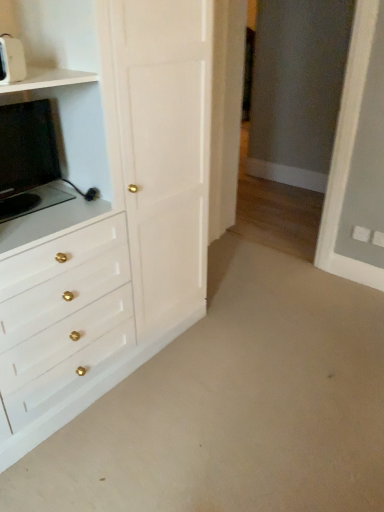
Question: Does matte black tv at left, marked as the 1th appliance in a back-to-front arrangement, have a lesser height compared to white glossy chest of drawers at left?

Choices:
 (A) no
 (B) yes

Answer: (B)

Question: Is matte black tv at left, marked as the 1th appliance in a back-to-front arrangement, directly adjacent to white glossy chest of drawers at left?

Choices:
 (A) yes
 (B) no

Answer: (B)

Question: Is white glossy chest of drawers at left at the back of matte black tv at left, marked as the second appliance in a front-to-back arrangement?

Choices:
 (A) no
 (B) yes

Answer: (B)

Question: From the image's perspective, would you say matte black tv at left, marked as the 1th appliance in a back-to-front arrangement, is shown under white glossy chest of drawers at left?

Choices:
 (A) no
 (B) yes

Answer: (A)

Question: Considering the relative positions of matte black tv at left, marked as the second appliance in a front-to-back arrangement, and white glossy chest of drawers at left in the image provided, is matte black tv at left, marked as the second appliance in a front-to-back arrangement, in front of white glossy chest of drawers at left?

Choices:
 (A) no
 (B) yes

Answer: (A)

Question: Considering the positions of point (9, 215) and point (11, 75), is point (9, 215) closer or farther from the camera than point (11, 75)?

Choices:
 (A) closer
 (B) farther

Answer: (B)

Question: From the image's perspective, is matte black tv at left, marked as the 1th appliance in a back-to-front arrangement, positioned above or below white plastic toaster at upper left, placed as the first appliance when sorted from front to back?

Choices:
 (A) below
 (B) above

Answer: (A)

Question: Considering the positions of matte black tv at left, marked as the 1th appliance in a back-to-front arrangement, and white plastic toaster at upper left, the second appliance when ordered from back to front, in the image, is matte black tv at left, marked as the 1th appliance in a back-to-front arrangement, taller or shorter than white plastic toaster at upper left, the second appliance when ordered from back to front,?

Choices:
 (A) short
 (B) tall

Answer: (B)

Question: In terms of width, does matte black tv at left, marked as the second appliance in a front-to-back arrangement, look wider or thinner when compared to white plastic toaster at upper left, the second appliance when ordered from back to front?

Choices:
 (A) wide
 (B) thin

Answer: (A)

Question: Is white glossy chest of drawers at left inside the boundaries of matte black tv at left, marked as the second appliance in a front-to-back arrangement, or outside?

Choices:
 (A) outside
 (B) inside

Answer: (A)

Question: In terms of height, does white glossy chest of drawers at left look taller or shorter compared to matte black tv at left, marked as the second appliance in a front-to-back arrangement?

Choices:
 (A) short
 (B) tall

Answer: (B)

Question: Is point (74, 155) closer or farther from the camera than point (33, 194)?

Choices:
 (A) farther
 (B) closer

Answer: (A)

Question: In terms of width, does white glossy chest of drawers at left look wider or thinner when compared to matte black tv at left, marked as the second appliance in a front-to-back arrangement?

Choices:
 (A) wide
 (B) thin

Answer: (A)

Question: From the image's perspective, is white plastic toaster at upper left, the second appliance when ordered from back to front, located above or below white glossy chest of drawers at left?

Choices:
 (A) below
 (B) above

Answer: (B)

Question: From a real-world perspective, is white plastic toaster at upper left, the second appliance when ordered from back to front, physically located above or below white glossy chest of drawers at left?

Choices:
 (A) below
 (B) above

Answer: (B)